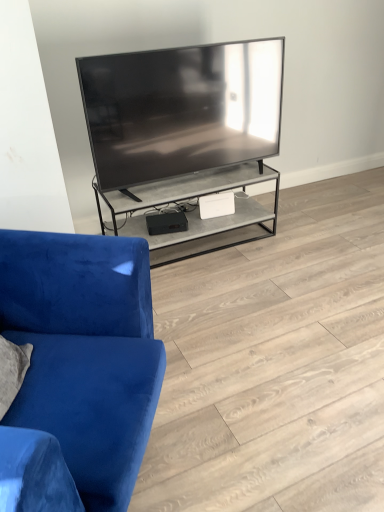
Question: From the image's perspective, relative to blue velvet couch at left, is velvet blue couch at left above or below?

Choices:
 (A) below
 (B) above

Answer: (A)

Question: In terms of width, does velvet blue couch at left look wider or thinner when compared to blue velvet couch at left?

Choices:
 (A) thin
 (B) wide

Answer: (A)

Question: Is point (34, 256) positioned closer to the camera than point (344, 240)?

Choices:
 (A) farther
 (B) closer

Answer: (B)

Question: From the image's perspective, is blue velvet couch at left positioned above or below velvet blue couch at left?

Choices:
 (A) below
 (B) above

Answer: (B)

Question: Is blue velvet couch at left in front of or behind velvet blue couch at left in the image?

Choices:
 (A) front
 (B) behind

Answer: (B)

Question: Considering the relative positions of blue velvet couch at left and velvet blue couch at left in the image provided, is blue velvet couch at left to the left or to the right of velvet blue couch at left?

Choices:
 (A) right
 (B) left

Answer: (A)

Question: Is blue velvet couch at left wider or thinner than velvet blue couch at left?

Choices:
 (A) wide
 (B) thin

Answer: (A)